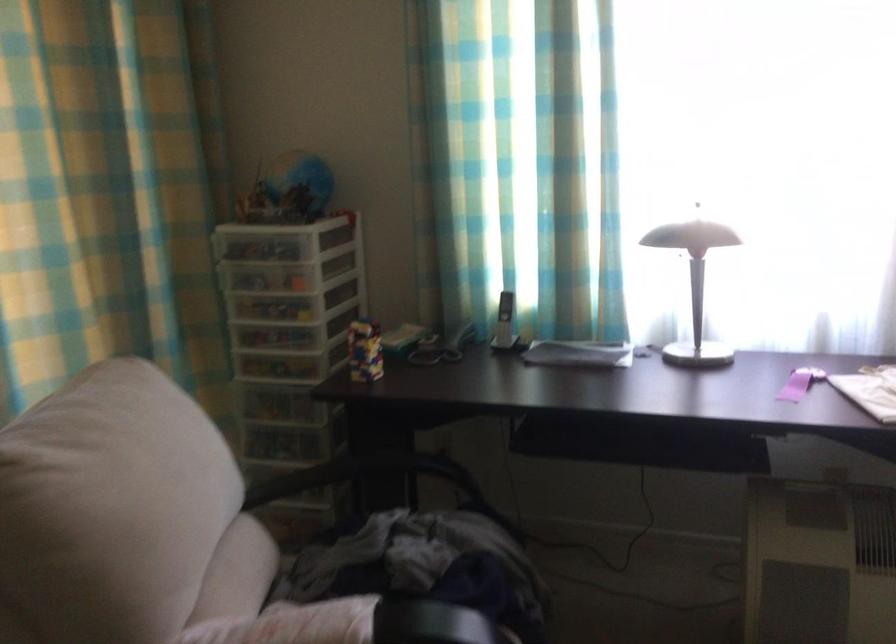
This screenshot has width=896, height=644. Describe the element at coordinates (407, 572) in the screenshot. I see `the sofa sitting surface` at that location.